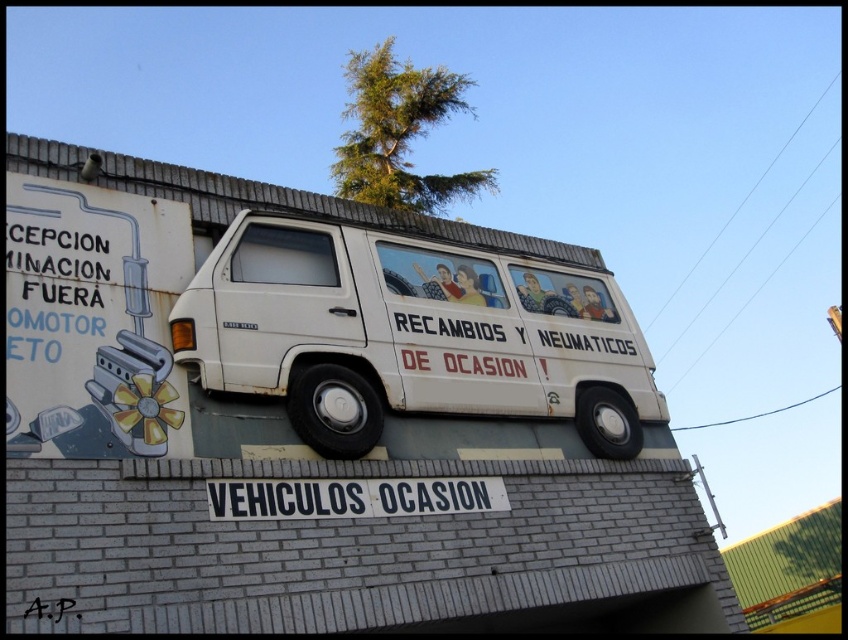
Question: Which of the following is the farthest from the observer?

Choices:
 (A) white painted signboard at center
 (B) white matte van at center

Answer: (B)

Question: Which point is closer to the camera taking this photo?

Choices:
 (A) (219, 513)
 (B) (177, 317)

Answer: (A)

Question: Can you confirm if white matte van at center is smaller than white painted signboard at center?

Choices:
 (A) yes
 (B) no

Answer: (B)

Question: Which point appears farthest from the camera in this image?

Choices:
 (A) (232, 515)
 (B) (271, 394)

Answer: (B)

Question: Can you confirm if white matte van at center is positioned to the left of white painted signboard at center?

Choices:
 (A) yes
 (B) no

Answer: (B)

Question: Can you confirm if white matte van at center is bigger than white painted signboard at center?

Choices:
 (A) no
 (B) yes

Answer: (B)